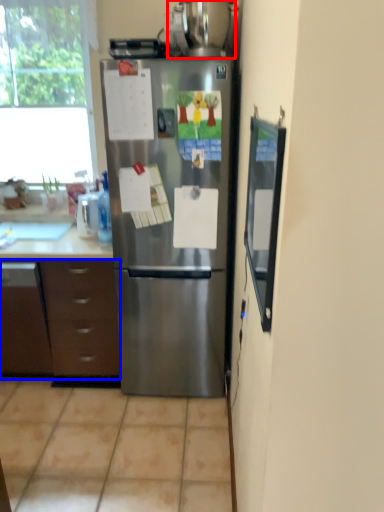
Question: Among these objects, which one is nearest to the camera, appliance (highlighted by a red box) or cabinetry (highlighted by a blue box)?

Choices:
 (A) appliance
 (B) cabinetry

Answer: (A)